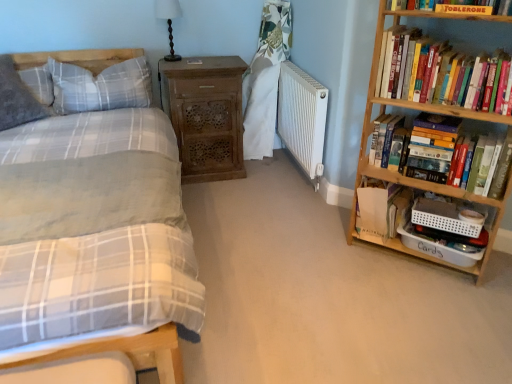
The height and width of the screenshot is (384, 512). I want to click on wooden carved nightstand at left, so click(x=205, y=115).

This screenshot has height=384, width=512. What do you see at coordinates (205, 115) in the screenshot?
I see `wooden carved nightstand at left` at bounding box center [205, 115].

Find the location of a particular element. This screenshot has height=384, width=512. gray plaid pillow at upper left, marked as the first pillow in a right-to-left arrangement is located at coordinates (101, 86).

What do you see at coordinates (95, 240) in the screenshot?
I see `matte plaid bed at left` at bounding box center [95, 240].

The height and width of the screenshot is (384, 512). What are the coordinates of `hardcover books at upper right, positioned as the first book in top-to-bottom order` in the screenshot? It's located at (440, 73).

What do you see at coordinates (16, 98) in the screenshot?
I see `soft gray pillow at upper left, placed as the 1th pillow when sorted from left to right` at bounding box center [16, 98].

You are a GUI agent. You are given a task and a screenshot of the screen. Output one action in this format:
    pyautogui.click(x=<x>, y=<y>)
    Task: Click on the wooden carved nightstand at left
    The width and height of the screenshot is (512, 384).
    Given the screenshot: What is the action you would take?
    pyautogui.click(x=205, y=115)

Considering the positions of objects white paper bag at right, which ranks as the 1th book in bottom-to-top order, and wooden carved nightstand at left in the image provided, who is more to the right, white paper bag at right, which ranks as the 1th book in bottom-to-top order, or wooden carved nightstand at left?

Positioned to the right is white paper bag at right, which ranks as the 1th book in bottom-to-top order.

Is wooden carved nightstand at left at the back of white paper bag at right, which is counted as the third book, starting from the top?

No, white paper bag at right, which is counted as the third book, starting from the top, is not facing the opposite direction of wooden carved nightstand at left.

Can you tell me how much white plastic basket at lower right and matte plaid bed at left differ in facing direction?

They differ by 45.4 degrees in their facing directions.

In the scene shown: Is white plastic basket at lower right facing away from matte plaid bed at left?

That's not correct — white plastic basket at lower right is not looking away from matte plaid bed at left.

From the image's perspective, is white plastic basket at lower right above or below matte plaid bed at left?

Clearly, from the image's perspective, white plastic basket at lower right is below matte plaid bed at left.

This screenshot has height=384, width=512. I want to click on bed in front of the white plastic basket at lower right, so pyautogui.click(x=95, y=240).

From a real-world perspective, is hardcover books at right, the second book from the bottom, on top of soft gray pillow at upper left, the 2th pillow viewed from the right?

Actually, hardcover books at right, the second book from the bottom, is physically below soft gray pillow at upper left, the 2th pillow viewed from the right, in the real world.

Is hardcover books at right, the second book from the bottom, positioned beyond the bounds of soft gray pillow at upper left, the 2th pillow viewed from the right?

hardcover books at right, the second book from the bottom, is positioned outside soft gray pillow at upper left, the 2th pillow viewed from the right.

Is the surface of hardcover books at right, positioned as the second book in top-to-bottom order, in direct contact with soft gray pillow at upper left, the 2th pillow viewed from the right?

No, hardcover books at right, positioned as the second book in top-to-bottom order, is not beside soft gray pillow at upper left, the 2th pillow viewed from the right.

Is hardcover books at right, positioned as the second book in top-to-bottom order, thinner than soft gray pillow at upper left, placed as the 1th pillow when sorted from left to right?

Indeed, hardcover books at right, positioned as the second book in top-to-bottom order, has a lesser width compared to soft gray pillow at upper left, placed as the 1th pillow when sorted from left to right.

What's the angular difference between matte yellow paperback book at upper right and soft gray pillow at upper left, placed as the 1th pillow when sorted from left to right,'s facing directions?

matte yellow paperback book at upper right and soft gray pillow at upper left, placed as the 1th pillow when sorted from left to right, are facing 36.8 degrees away from each other.

Identify the location of paperback book that is above the soft gray pillow at upper left, placed as the 1th pillow when sorted from left to right (from the image's perspective). This screenshot has width=512, height=384. (464, 9).

Which object is closer to the camera, matte yellow paperback book at upper right or soft gray pillow at upper left, placed as the 1th pillow when sorted from left to right?

matte yellow paperback book at upper right is closer to the camera.

Is black wood table lamp at upper center far away from hardcover books at right, the second book from the bottom?

Yes.

In the scene shown: Which object is closer to the camera taking this photo, black wood table lamp at upper center or hardcover books at right, positioned as the second book in top-to-bottom order?

Positioned in front is hardcover books at right, positioned as the second book in top-to-bottom order.

Considering the positions of points (159, 8) and (369, 134), is point (159, 8) closer to camera compared to point (369, 134)?

No.

Considering the relative sizes of black wood table lamp at upper center and hardcover books at right, positioned as the second book in top-to-bottom order, in the image provided, is black wood table lamp at upper center wider than hardcover books at right, positioned as the second book in top-to-bottom order,?

No, black wood table lamp at upper center is not wider than hardcover books at right, positioned as the second book in top-to-bottom order.

Are white plastic basket at lower right and wooden carved nightstand at left located far from each other?

Absolutely, white plastic basket at lower right is distant from wooden carved nightstand at left.

From the image's perspective, which object appears higher, white plastic basket at lower right or wooden carved nightstand at left?

wooden carved nightstand at left.

Is the depth of white plastic basket at lower right greater than that of wooden carved nightstand at left?

No, it is not.

Locate an element on the screen. The width and height of the screenshot is (512, 384). shelf in front of the wooden carved nightstand at left is located at coordinates (384, 218).

Which object is closer to the camera taking this photo, white matte radiator at center or black wood table lamp at upper center?

white matte radiator at center.

Is point (303, 132) closer to viewer compared to point (164, 10)?

Yes, it is.

From a real-world perspective, is white matte radiator at center positioned over black wood table lamp at upper center based on gravity?

Actually, white matte radiator at center is physically below black wood table lamp at upper center in the real world.

From the image's perspective, is white matte radiator at center below black wood table lamp at upper center?

Correct, white matte radiator at center appears lower than black wood table lamp at upper center in the image.

The width and height of the screenshot is (512, 384). What are the coordinates of `nightstand on the left of white paper bag at right, which ranks as the 1th book in bottom-to-top order` in the screenshot? It's located at (205, 115).

Where is `bed that is in front of the white plastic basket at lower right`? bed that is in front of the white plastic basket at lower right is located at coordinates (95, 240).

From the image, which object appears to be nearer to hardcover books at right, the second book from the bottom, soft gray pillow at upper left, the 2th pillow viewed from the right, or white paper bag at right, which is counted as the third book, starting from the top?

white paper bag at right, which is counted as the third book, starting from the top, is closer to hardcover books at right, the second book from the bottom.

In the scene shown: Considering their positions, is white paper bag at right, which ranks as the 1th book in bottom-to-top order, positioned closer to wooden carved nightstand at left than matte yellow paperback book at upper right?

Based on the image, white paper bag at right, which ranks as the 1th book in bottom-to-top order, appears to be nearer to wooden carved nightstand at left.

Considering their positions, is matte plaid bed at left positioned closer to white matte radiator at center than wooden bookshelf at right?

Among the two, wooden bookshelf at right is located nearer to white matte radiator at center.

Based on the photo, from the image, which object appears to be nearer to black wood table lamp at upper center, soft gray pillow at upper left, the 2th pillow viewed from the right, or matte yellow paperback book at upper right?

Among the two, soft gray pillow at upper left, the 2th pillow viewed from the right, is located nearer to black wood table lamp at upper center.

From the image, which object appears to be farther from white paper bag at right, which is counted as the third book, starting from the top, gray plaid pillow at upper left, which ranks as the second pillow in left-to-right order, or hardcover books at right, the second book from the bottom?

gray plaid pillow at upper left, which ranks as the second pillow in left-to-right order, lies further to white paper bag at right, which is counted as the third book, starting from the top, than the other object.

Based on their spatial positions, is wooden carved nightstand at left or gray plaid pillow at upper left, which ranks as the second pillow in left-to-right order, closer to black wood table lamp at upper center?

Among the two, gray plaid pillow at upper left, which ranks as the second pillow in left-to-right order, is located nearer to black wood table lamp at upper center.

From the image, which object appears to be farther from matte yellow paperback book at upper right, black wood table lamp at upper center or white paper bag at right, which ranks as the 1th book in bottom-to-top order?

Based on the image, black wood table lamp at upper center appears to be further to matte yellow paperback book at upper right.

Looking at the image, which one is located further to white matte radiator at center, white plastic basket at lower right or black wood table lamp at upper center?

Among the two, black wood table lamp at upper center is located further to white matte radiator at center.

Find the location of a particular element. The height and width of the screenshot is (384, 512). shelf between wooden bookshelf at right and white fabric curtain at center in the front-back direction is located at coordinates (384, 218).

Find the location of a particular element. The height and width of the screenshot is (384, 512). paperback book located between matte plaid bed at left and hardcover books at upper right, marked as the third book in a bottom-to-top arrangement, in the left-right direction is located at coordinates (464, 9).

Locate an element on the screen. nightstand between black wood table lamp at upper center and white plastic basket at lower right in the horizontal direction is located at coordinates tap(205, 115).

I want to click on paperback book between matte plaid bed at left and white fabric curtain at center from front to back, so click(x=464, y=9).